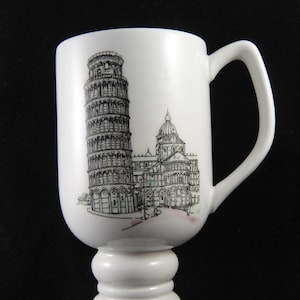
Find the location of `coffee cup`. coffee cup is located at coordinates (168, 96).